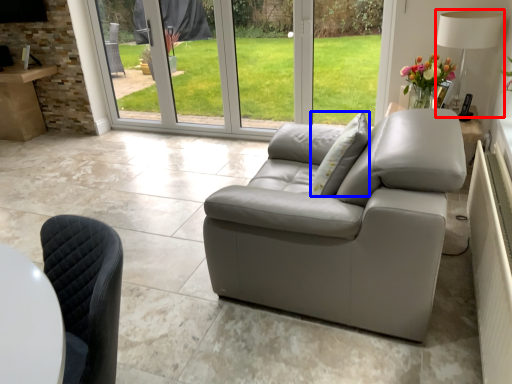
Question: Which object appears farthest to the camera in this image, lamp (highlighted by a red box) or pillow (highlighted by a blue box)?

Choices:
 (A) lamp
 (B) pillow

Answer: (A)